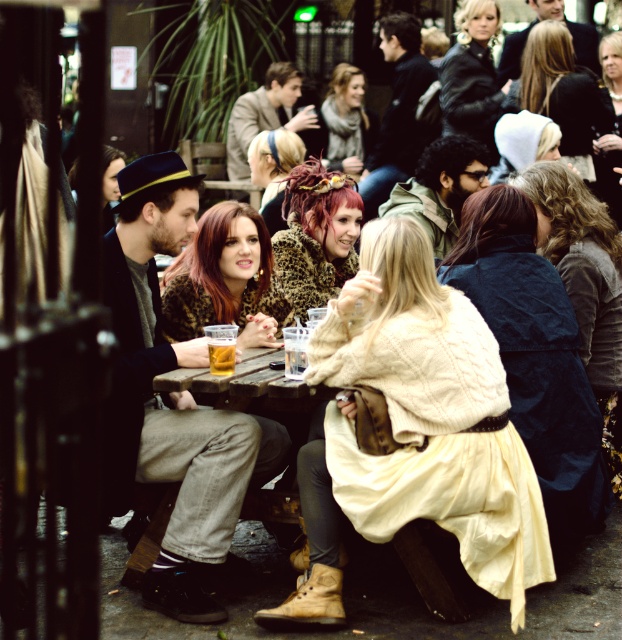
Question: Does velvet blue coat at center appear under black leather jacket at upper center?

Choices:
 (A) no
 (B) yes

Answer: (B)

Question: Which of these objects is positioned closest to the matte black hat at upper left?

Choices:
 (A) velvet blue coat at center
 (B) wooden table at center
 (C) translucent glass cup at center

Answer: (B)

Question: From the image, what is the correct spatial relationship of velvet blue coat at center in relation to leopard print hairband at center?

Choices:
 (A) above
 (B) below

Answer: (B)

Question: Which point appears closest to the camera in this image?

Choices:
 (A) (230, 342)
 (B) (361, 161)

Answer: (A)

Question: Which object appears farthest from the camera in this image?

Choices:
 (A) leopard print hairband at center
 (B) velvet blue coat at center
 (C) black leather jacket at upper center

Answer: (C)

Question: Is matte black jacket at upper right positioned in front of black leather jacket at upper center?

Choices:
 (A) yes
 (B) no

Answer: (B)